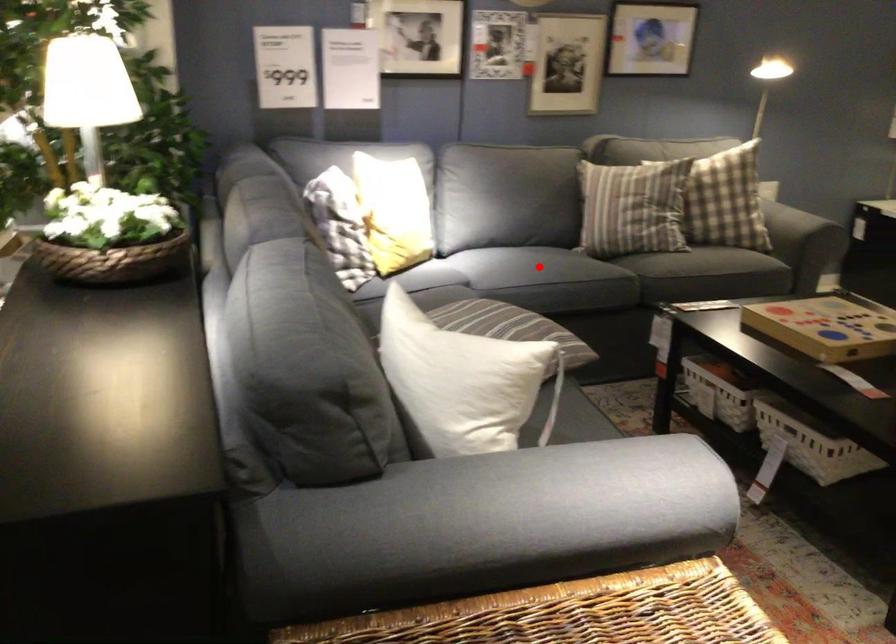
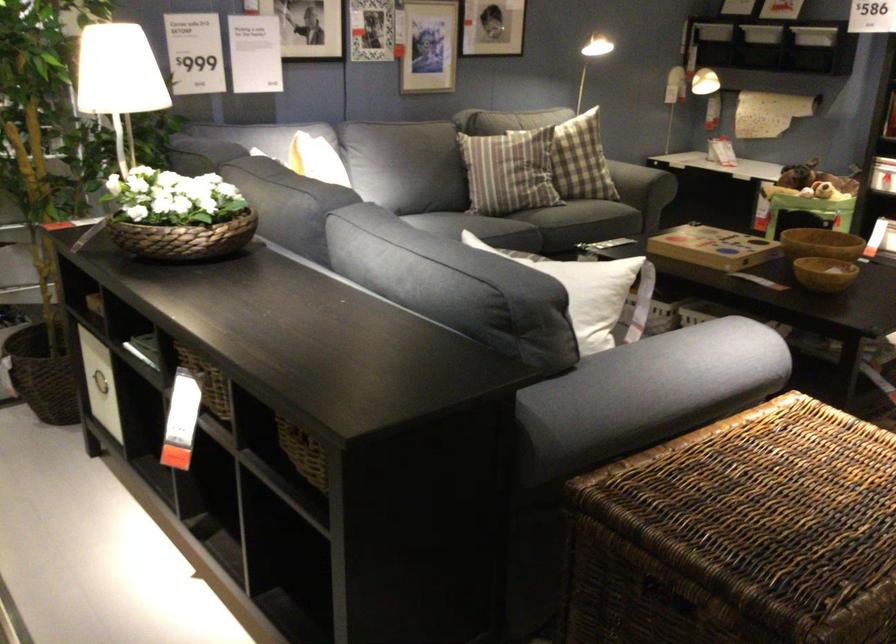
Question: I am providing you with two images of the same scene from different viewpoints. A red point is marked on the first image. Is the red point's position out of view in image 2?

Choices:
 (A) Yes
 (B) No

Answer: (A)